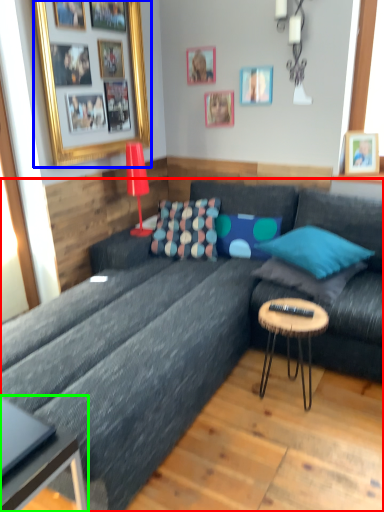
Question: Which object is positioned closest to studio couch (highlighted by a red box)? Select from picture frame (highlighted by a blue box) and coffee table (highlighted by a green box).

Choices:
 (A) picture frame
 (B) coffee table

Answer: (B)